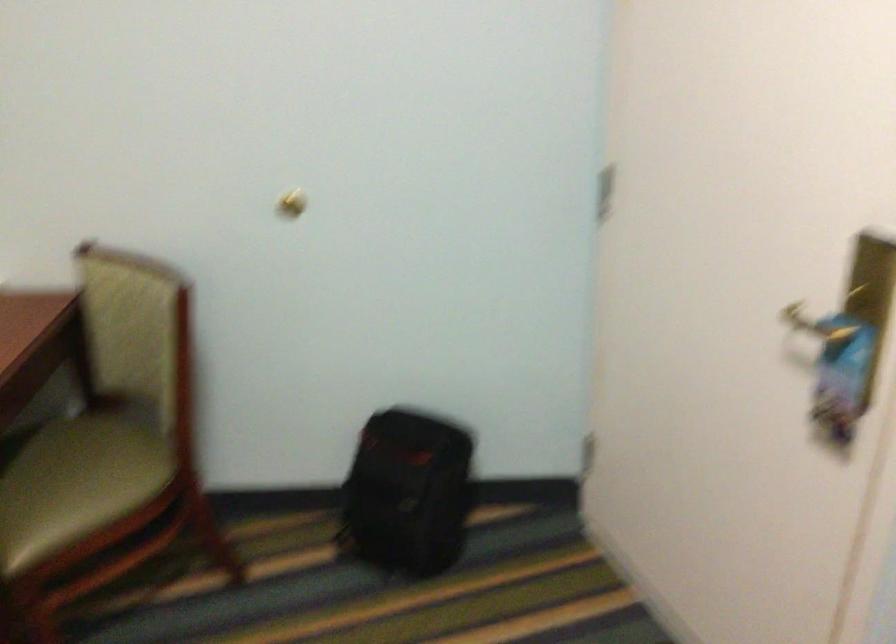
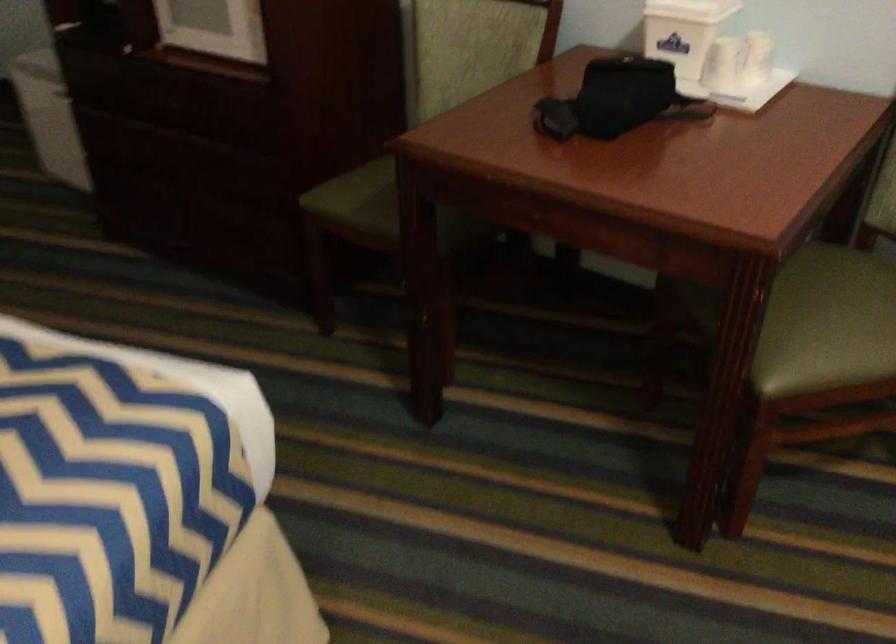
The point at (71, 483) is marked in the first image. Where is the corresponding point in the second image?

(837, 316)